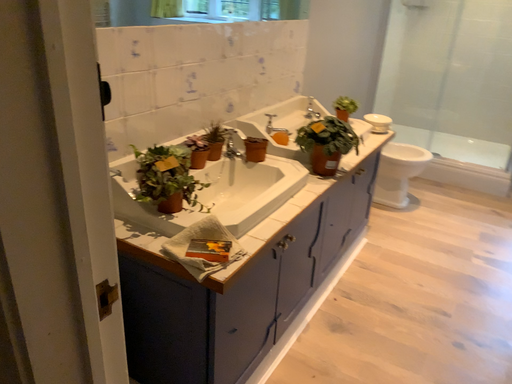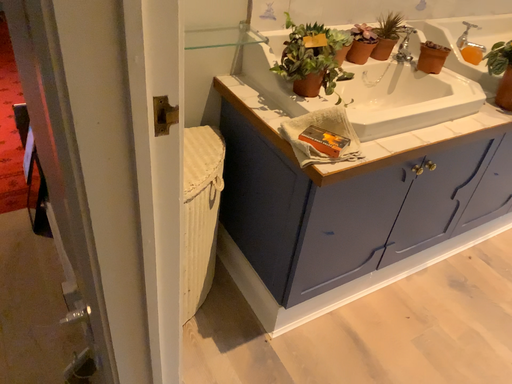
Question: Which way did the camera rotate in the video?

Choices:
 (A) rotated left
 (B) rotated right

Answer: (A)